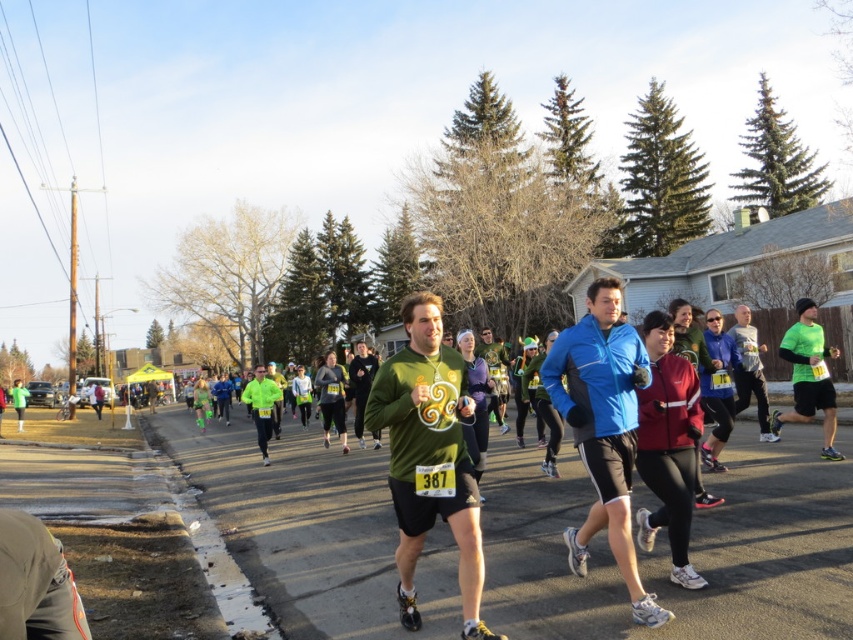
Is green matte long-sleeve shirt at center thinner than green matte shirt at center?

Yes.

Which is more to the left, green matte long-sleeve shirt at center or green matte shirt at center?

green matte shirt at center

Does point (448, 486) come in front of point (361, 376)?

Yes, point (448, 486) is closer to viewer.

Where is `green matte long-sleeve shirt at center`? green matte long-sleeve shirt at center is located at coordinates (428, 456).

How much distance is there between green fleece jacket at center and green matte sweater at center?

green fleece jacket at center and green matte sweater at center are 17.66 feet apart from each other.

You are a GUI agent. You are given a task and a screenshot of the screen. Output one action in this format:
    pyautogui.click(x=<x>, y=<y>)
    Task: Click on the green fleece jacket at center
    This screenshot has height=640, width=853.
    Given the screenshot: What is the action you would take?
    [750, 369]

The width and height of the screenshot is (853, 640). I want to click on green matte long-sleeve shirt at center, so click(428, 456).

Between point (460, 378) and point (491, 355), which one is positioned in front?

Point (460, 378) is more forward.

This screenshot has width=853, height=640. I want to click on green matte long-sleeve shirt at center, so click(428, 456).